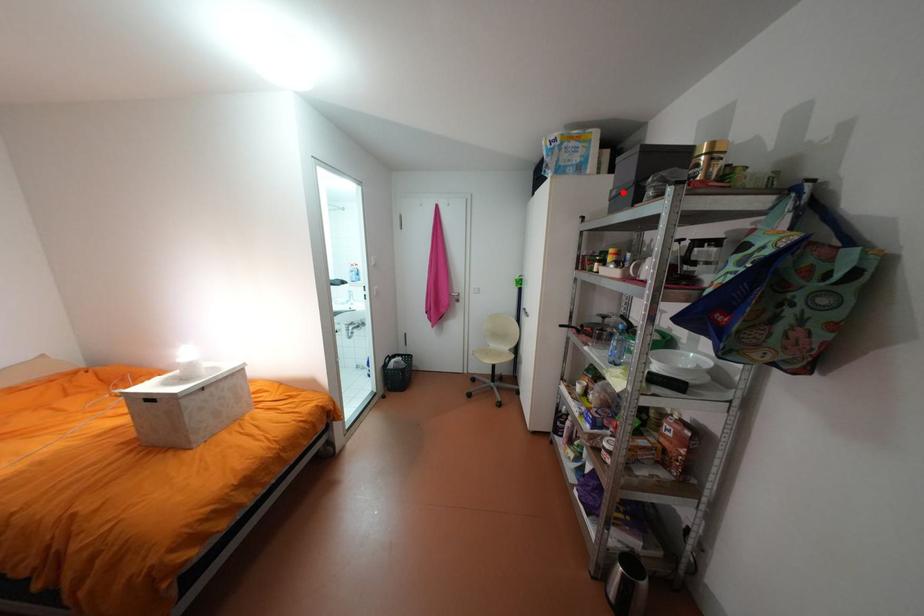
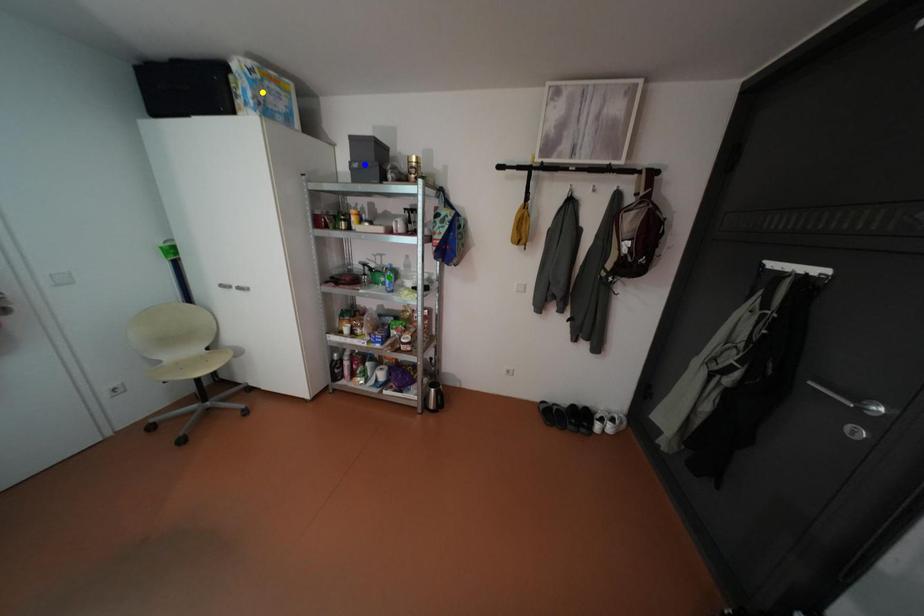
Question: I am providing you with two images of the same scene from different viewpoints. A red point is marked on the first image. You are given multiple points on the second image. In image 2, which mark is for the same physical point as the one in image 1?

Choices:
 (A) blue point
 (B) green point
 (C) yellow point

Answer: (A)